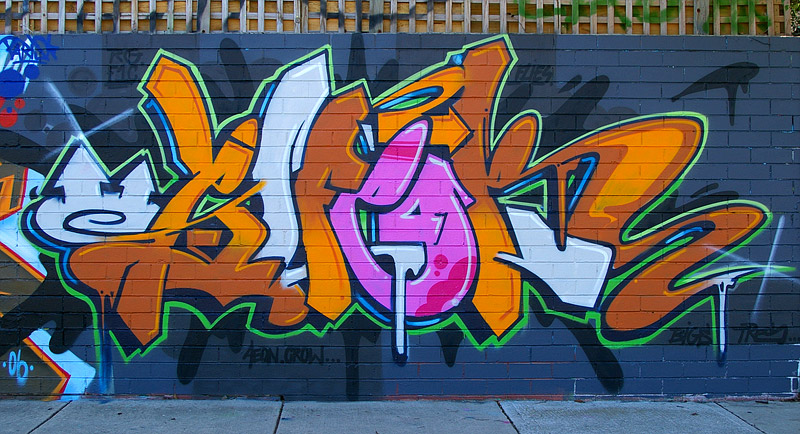
Image resolution: width=800 pixels, height=434 pixels. Identify the location of light orange in wall tag. (208, 168), (314, 263), (457, 80), (498, 239), (641, 166).